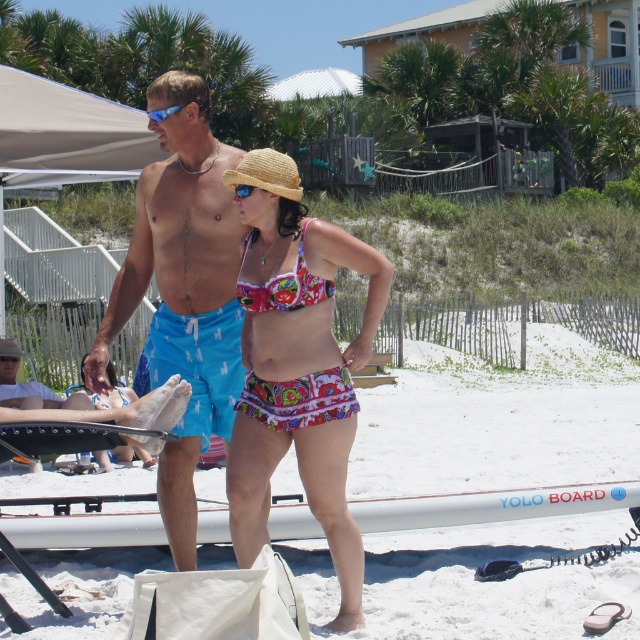
You are a photographer trying to capture both the floral bikini at center and the printed fabric bikini at center in a single shot. Which bikini is closer to the camera?

The floral bikini at center is positioned under the printed fabric bikini at center, meaning it is closer to the camera.